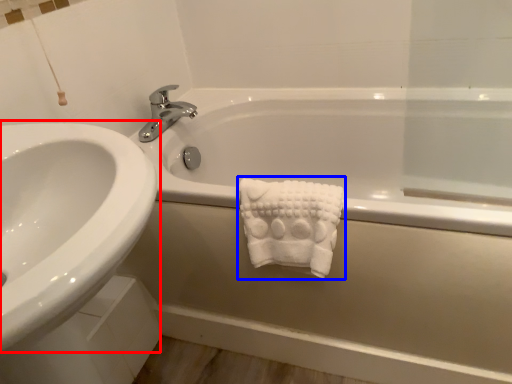
Question: Which point is closer to the camera, sink (highlighted by a red box) or bath towel (highlighted by a blue box)?

Choices:
 (A) sink
 (B) bath towel

Answer: (A)